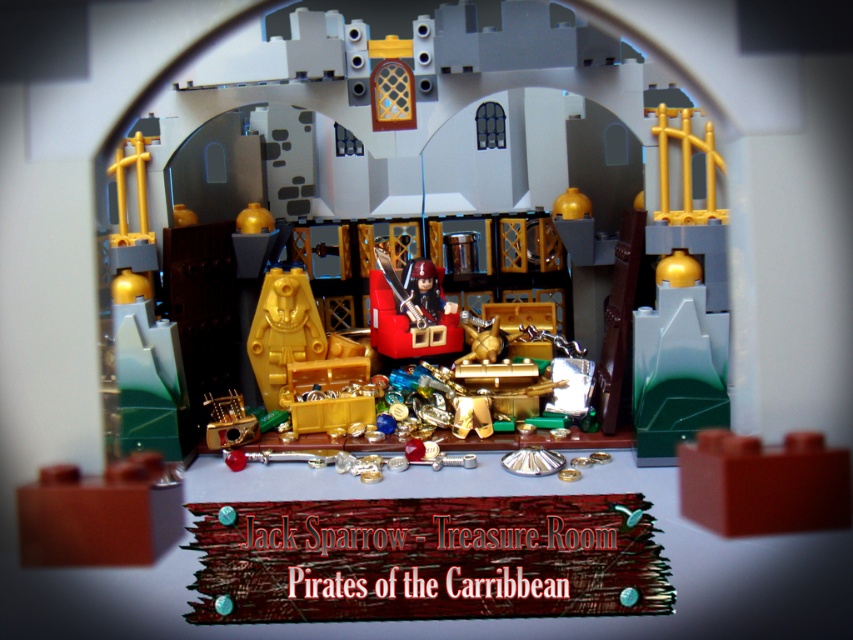
You are a pirate captain standing in the treasure room and see the matte black pirate ship at center and the matte gold treasure chest at center. Which object is positioned to the right side of the other?

The matte black pirate ship at center is to the right of the matte gold treasure chest at center.

You are a pirate captain in the LEGO diorama and want to hide a valuable artifact. Which object, the matte black pirate ship at center or the matte gold treasure chest at center, would be a better choice to place the artifact on top of so it can be seen from a distance?

The matte gold treasure chest at center is taller than the matte black pirate ship at center, so placing the artifact on top of the matte gold treasure chest at center would make it more visible from a distance.

You are a pirate captain in the LEGO diorama. You see the matte black pirate ship at center and the matte gold treasure chest at center. Which object is closer to you?

The matte black pirate ship at center is closer to you because the matte gold treasure chest at center is behind it.